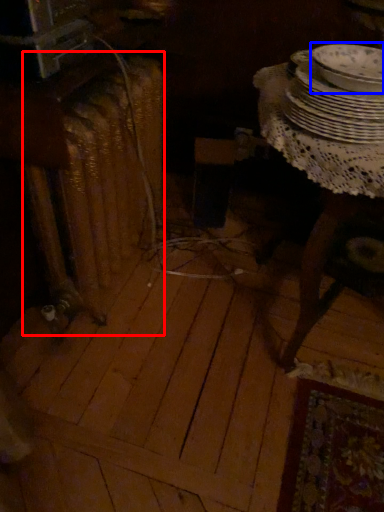
Question: Which object appears farthest to the camera in this image, radiator (highlighted by a red box) or tableware (highlighted by a blue box)?

Choices:
 (A) radiator
 (B) tableware

Answer: (A)